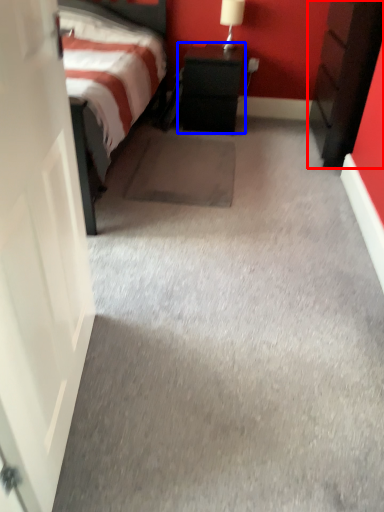
Question: Which point is further to the camera, nightstand (highlighted by a red box) or nightstand (highlighted by a blue box)?

Choices:
 (A) nightstand
 (B) nightstand

Answer: (B)